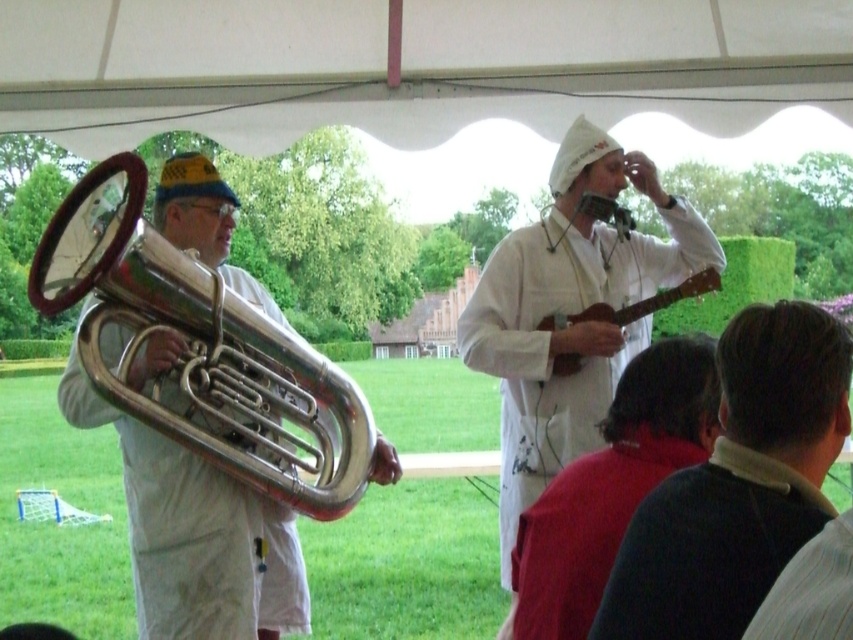
You are setting up a microphone stand between the polished silver trumpet at left and the white matte guitar at upper center. The stand requires at least 4 feet of space between the two instruments to fit properly. Based on the scene description, will the stand fit?

The distance between the polished silver trumpet at left and the white matte guitar at upper center is 4.43 feet, which is more than the required 4 feet. Therefore, the microphone stand will fit comfortably between them.